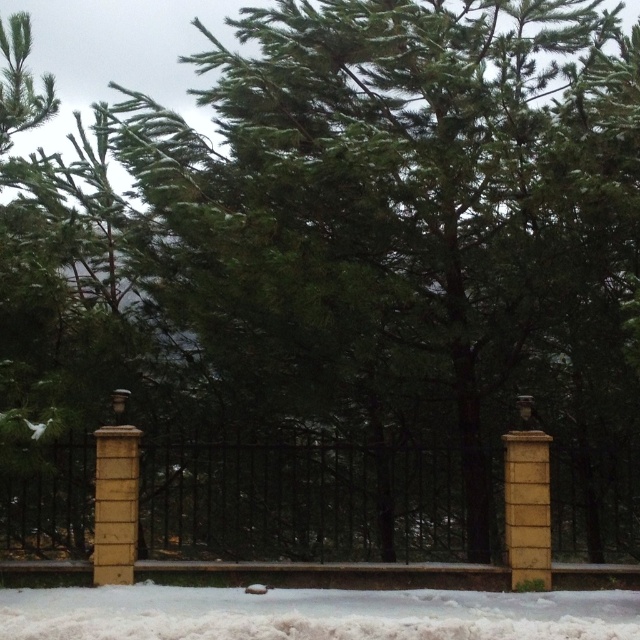
You are standing in front of the winter scene with the fence and stone pillars. There are two points marked in the image. If you were to walk towards the fence, which point, point (x=372, y=552) or point (x=106, y=600), would you reach first?

Point (x=106, y=600) would be reached first because it is closer to the viewer than point (x=372, y=552), which is further away.

You are standing in a snowy winter scene and see the brown stone fence at center. Based on its coordinates, can you determine if it is closer to the top or bottom of the image?

The brown stone fence at center is located at point 0.784 on the x axis and 0.470 on the y axis. Since the y coordinate is closer to 0.5, it is positioned near the center vertically, so it is neither closer to the top nor the bottom of the image.

You are a delivery person trying to navigate through the snow to reach a house behind the brown stone fence at center. The white fluffy snow at lower center is the only clear path. Is the path under the fence wide enough for your delivery cart?

The brown stone fence at center is located above the white fluffy snow at lower center, meaning the fence is positioned over the path. Since the snow is at the lower center, the fence might block the path, making it too narrow for the delivery cart to pass underneath. Check the height clearance before proceeding.